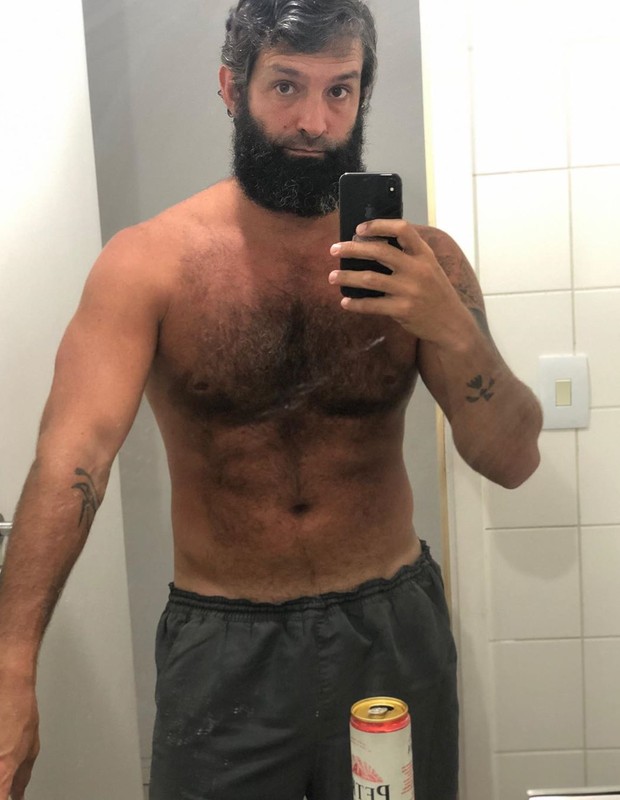
Where is `metal bathroom grip`? The image size is (620, 800). metal bathroom grip is located at coordinates (4, 528).